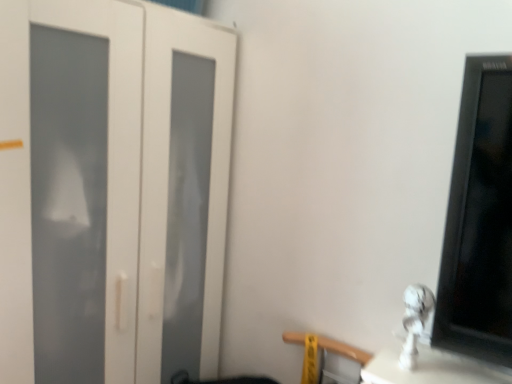
The width and height of the screenshot is (512, 384). I want to click on white glossy statue at lower right, so click(x=414, y=321).

Describe the element at coordinates (414, 321) in the screenshot. I see `white glossy statue at lower right` at that location.

The height and width of the screenshot is (384, 512). Describe the element at coordinates (112, 190) in the screenshot. I see `white matte door at left` at that location.

You are a GUI agent. You are given a task and a screenshot of the screen. Output one action in this format:
    pyautogui.click(x=<x>, y=<y>)
    Task: Click on the white glossy statue at lower right
    This screenshot has width=512, height=384.
    Given the screenshot: What is the action you would take?
    pyautogui.click(x=414, y=321)

Considering their positions, is wooden at lower right located in front of or behind white matte door at left?

wooden at lower right is behind white matte door at left.

In the image, there is a wooden at lower right. Identify the location of door above it (from the image's perspective). This screenshot has width=512, height=384. (112, 190).

From a real-world perspective, which object rests below the other?

wooden at lower right, from a real-world perspective.

Consider the image. From the image's perspective, is wooden at lower right positioned above or below white matte door at left?

From the image's perspective, wooden at lower right appears below white matte door at left.

Is white matte door at left aimed at white glossy statue at lower right?

Yes, white matte door at left is facing white glossy statue at lower right.

Considering the positions of objects white matte door at left and white glossy statue at lower right in the image provided, who is more to the left, white matte door at left or white glossy statue at lower right?

white matte door at left.

Is white matte door at left bigger than white glossy statue at lower right?

Correct, white matte door at left is larger in size than white glossy statue at lower right.

Is white matte door at left far from white glossy statue at lower right?

white matte door at left is actually quite close to white glossy statue at lower right.

Considering the relative sizes of white glossy statue at lower right and wooden at lower right in the image provided, is white glossy statue at lower right wider than wooden at lower right?

No.

Does white glossy statue at lower right have a larger size compared to wooden at lower right?

Incorrect, white glossy statue at lower right is not larger than wooden at lower right.

How much distance is there between white glossy statue at lower right and wooden at lower right?

47.87 centimeters.

The height and width of the screenshot is (384, 512). What are the coordinates of `chair to the left of white glossy statue at lower right` in the screenshot? It's located at (325, 355).

Could wooden at lower right be considered to be inside white matte door at left?

That's incorrect, wooden at lower right is not inside white matte door at left.

Which object is closer to the camera taking this photo, white matte door at left or wooden at lower right?

white matte door at left is more forward.

What's the angular difference between white matte door at left and wooden at lower right's facing directions?

There is a 87.6-degree angle between the facing directions of white matte door at left and wooden at lower right.

Considering the sizes of objects white matte door at left and wooden at lower right in the image provided, who is smaller, white matte door at left or wooden at lower right?

With smaller size is wooden at lower right.

Would you say wooden at lower right is inside or outside white glossy statue at lower right?

wooden at lower right is located beyond the bounds of white glossy statue at lower right.

Is wooden at lower right beside white glossy statue at lower right?

No.

Looking at this image, between wooden at lower right and white glossy statue at lower right, which one is positioned behind?

wooden at lower right is more distant.

Is white glossy statue at lower right aimed at white matte door at left?

No, white glossy statue at lower right is not oriented towards white matte door at left.

Identify the location of door above the white glossy statue at lower right (from the image's perspective). The height and width of the screenshot is (384, 512). (112, 190).

Is white glossy statue at lower right bigger than white matte door at left?

Incorrect, white glossy statue at lower right is not larger than white matte door at left.

Which is in front, point (407, 326) or point (61, 245)?

Point (407, 326)

Where is `door that appears above the wooden at lower right (from the image's perspective)`? The width and height of the screenshot is (512, 384). door that appears above the wooden at lower right (from the image's perspective) is located at coordinates (112, 190).

At what (x,y) coordinates should I click in order to perform the action: click on door located on the left of white glossy statue at lower right. Please return your answer as a coordinate pair (x, y). Looking at the image, I should click on (112, 190).

Based on their spatial positions, is wooden at lower right or white matte door at left further from white glossy statue at lower right?

Based on the image, white matte door at left appears to be further to white glossy statue at lower right.

Estimate the real-world distances between objects in this image. Which object is further from wooden at lower right, white glossy statue at lower right or white matte door at left?

Based on the image, white matte door at left appears to be further to wooden at lower right.

When comparing their distances from wooden at lower right, does white matte door at left or white glossy statue at lower right seem closer?

white glossy statue at lower right is positioned closer to the anchor wooden at lower right.

Which object lies further to the anchor point white matte door at left, wooden at lower right or white glossy statue at lower right?

white glossy statue at lower right lies further to white matte door at left than the other object.

Considering their positions, is white matte door at left positioned closer to white glossy statue at lower right than wooden at lower right?

wooden at lower right is closer to white glossy statue at lower right.

From the image, which object appears to be nearer to white matte door at left, white glossy statue at lower right or wooden at lower right?

wooden at lower right lies closer to white matte door at left than the other object.

Find the location of `chair between white matte door at left and white glossy statue at lower right in the horizontal direction`. chair between white matte door at left and white glossy statue at lower right in the horizontal direction is located at coordinates (325, 355).